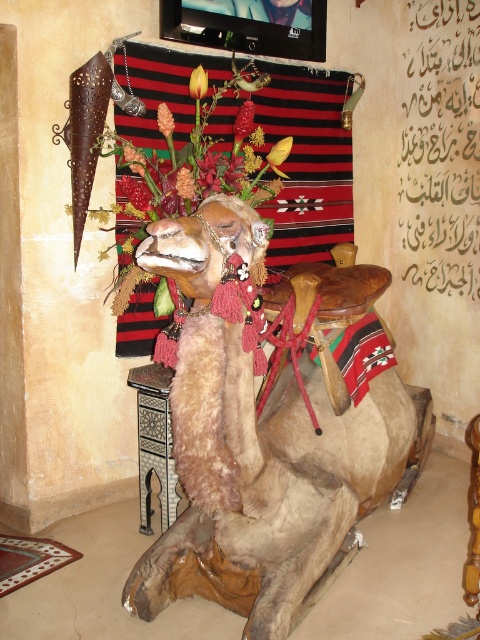
You are an interior designer arranging flowers on a camel sculpture. You have a red velvet flower at upper center and a smooth yellow flower at upper center. Which flower is placed below the other?

The red velvet flower at upper center is positioned under the smooth yellow flower at upper center.

You are standing in front of a decorative display. You see a furry beige camel at center and a red velvet flower at upper center. Which object is positioned to the right of the other?

The furry beige camel at center is to the right of the red velvet flower at upper center.

You are an interior designer assessing the space in the room. The furry beige camel at center and the red velvet flower at upper center are part of the decor. Which object takes up more horizontal space?

The furry beige camel at center takes up more horizontal space than the red velvet flower at upper center because its width surpasses the flower.